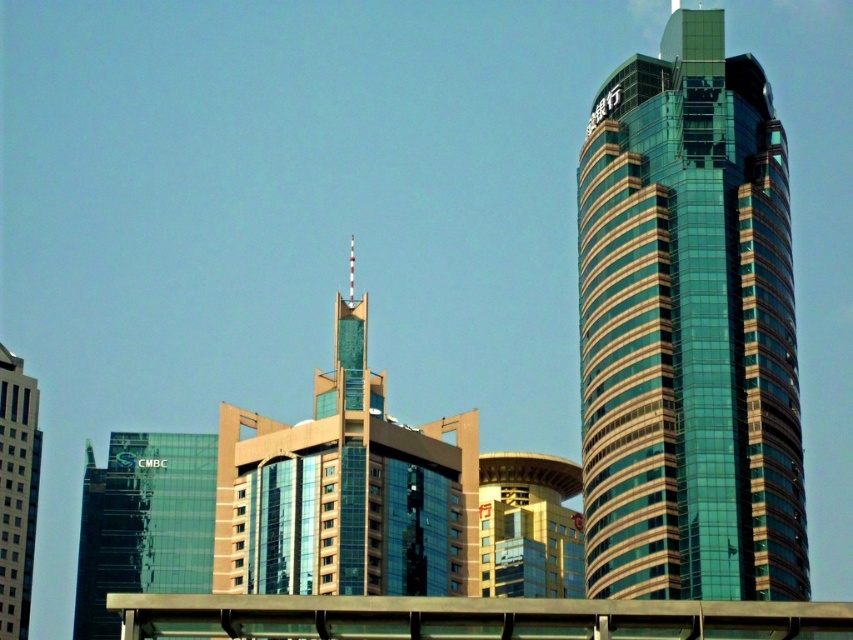
Looking at this image, who is higher up, transparent glass building at left or matte glass building at left?

matte glass building at left is higher up.

Is point (117, 561) positioned after point (28, 580)?

Yes.

Locate an element on the screen. Image resolution: width=853 pixels, height=640 pixels. transparent glass building at left is located at coordinates (143, 522).

Does green glass skyscraper at right appear on the left side of gold textured building at center?

Incorrect, green glass skyscraper at right is not on the left side of gold textured building at center.

Which is behind, point (711, 266) or point (488, 563)?

The point (488, 563) is behind.

Where is `green glass skyscraper at right`? The height and width of the screenshot is (640, 853). green glass skyscraper at right is located at coordinates (688, 330).

Which is behind, point (521, 490) or point (4, 404)?

The point (521, 490) is behind.

Does gold textured building at center have a lesser width compared to matte glass building at left?

In fact, gold textured building at center might be wider than matte glass building at left.

This screenshot has height=640, width=853. Describe the element at coordinates (529, 525) in the screenshot. I see `gold textured building at center` at that location.

I want to click on gold textured building at center, so click(x=529, y=525).